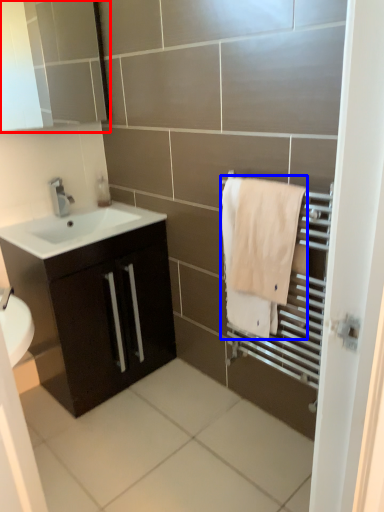
Question: Which object appears farthest to the camera in this image, medicine cabinet (highlighted by a red box) or bath towel (highlighted by a blue box)?

Choices:
 (A) medicine cabinet
 (B) bath towel

Answer: (A)